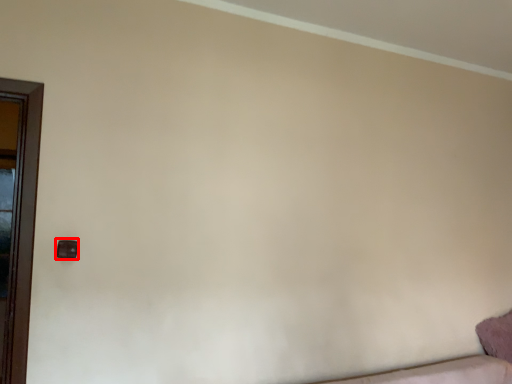
Question: Observing the image, what is the correct spatial positioning of door handle (annotated by the red box) in reference to pillow?

Choices:
 (A) left
 (B) right

Answer: (A)